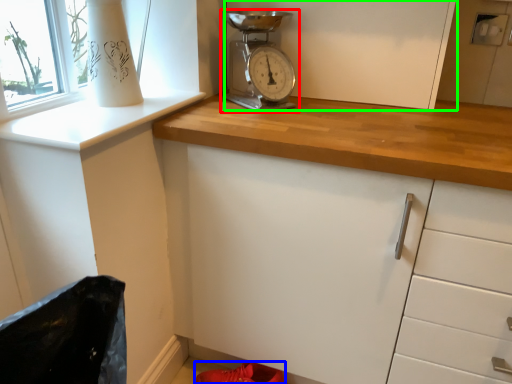
Question: Based on their relative distances, which object is nearer to home appliance (highlighted by a red box)? Choose from footwear (highlighted by a blue box) and cabinetry (highlighted by a green box).

Choices:
 (A) footwear
 (B) cabinetry

Answer: (B)